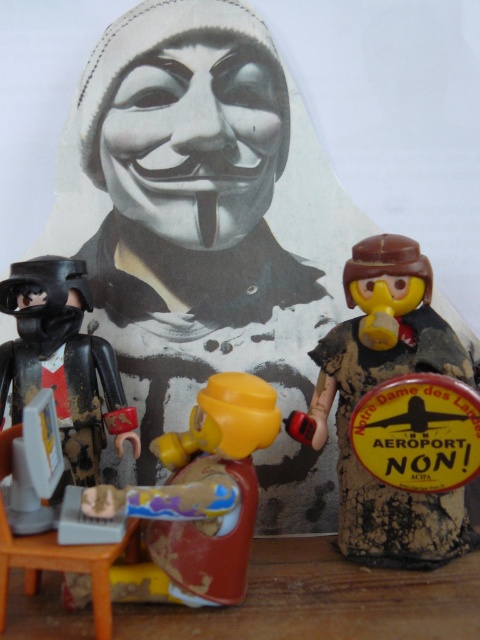
You are a collector who wants to place a new toy figure between the wooden figure at right and the matte yellow figure at center. The new toy is 14 centimeters wide. Will there be enough space?

The wooden figure at right is 15.01 centimeters away from the matte yellow figure at center. Since the distance between them is greater than the width of the new toy, there will be enough space to place it between them.

You are a collector organizing a display. You have a wooden figure at right and a black matte armor at left. Based on their positions, which one is closer to the floor?

The wooden figure at right is below the black matte armor at left, so it is closer to the floor.

You are a collector organizing a display case for your toys. You have a matte yellow figure at center and a black matte armor at left. If you want to place them side by side without overlapping, which one should be placed first to the left to ensure they fit properly?

The matte yellow figure at center is wider than the black matte armor at left. Therefore, you should place the matte yellow figure at center first to the left since it is wider and will occupy more space, allowing the narrower black matte armor at left to fit next to it without overlapping.